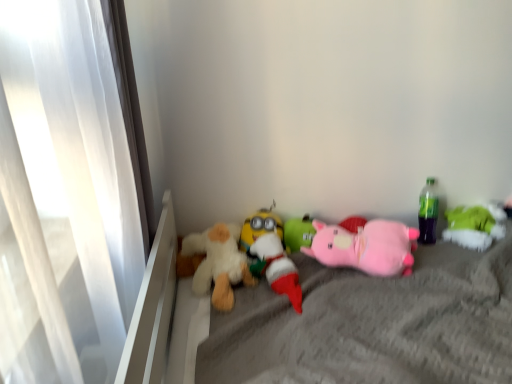
What do you see at coordinates (260, 228) in the screenshot? I see `yellow plush toy at center, which is the 2th toy from left to right` at bounding box center [260, 228].

Measure the distance between yellow plush toy at center, the fifth toy in the right-to-left sequence, and camera.

yellow plush toy at center, the fifth toy in the right-to-left sequence, is 1.58 meters from camera.

Measure the distance between point (484, 241) and camera.

Point (484, 241) and camera are 1.67 meters apart from each other.

Locate an element on the screen. Image resolution: width=512 pixels, height=384 pixels. white plush toy at center, which is counted as the fourth toy, starting from the right is located at coordinates (276, 268).

Measure the distance between point (x=263, y=242) and camera.

Point (x=263, y=242) is 1.54 meters from camera.

The width and height of the screenshot is (512, 384). What do you see at coordinates (359, 325) in the screenshot?
I see `soft gray fabric mattress at center` at bounding box center [359, 325].

Image resolution: width=512 pixels, height=384 pixels. Identify the location of yellow plush toy at center, the fifth toy in the right-to-left sequence. (260, 228).

Is pink plush pig at center, arranged as the 5th toy when viewed from the left, taller or shorter than yellow plush toy at center, the fifth toy in the right-to-left sequence?

In the image, pink plush pig at center, arranged as the 5th toy when viewed from the left, appears to be shorter than yellow plush toy at center, the fifth toy in the right-to-left sequence.

Does pink plush pig at center, arranged as the 5th toy when viewed from the left, have a larger size compared to yellow plush toy at center, which is the 2th toy from left to right?

Correct, pink plush pig at center, arranged as the 5th toy when viewed from the left, is larger in size than yellow plush toy at center, which is the 2th toy from left to right.

Do you think pink plush pig at center, arranged as the 5th toy when viewed from the left, is within yellow plush toy at center, the fifth toy in the right-to-left sequence, or outside of it?

pink plush pig at center, arranged as the 5th toy when viewed from the left, is not inside yellow plush toy at center, the fifth toy in the right-to-left sequence, it's outside.

Based on the photo, is pink plush pig at center, the second toy viewed from the right, far away from yellow plush toy at center, the fifth toy in the right-to-left sequence?

No, pink plush pig at center, the second toy viewed from the right, is not far from yellow plush toy at center, the fifth toy in the right-to-left sequence.

Is soft gray fabric mattress at center behind green fabric pillow at right, which ranks as the first toy in right-to-left order?

No, soft gray fabric mattress at center is closer to the viewer.

Is soft gray fabric mattress at center positioned with its back to green fabric pillow at right, which is the 6th toy from left to right?

No, soft gray fabric mattress at center is not facing away from green fabric pillow at right, which is the 6th toy from left to right.

Is soft gray fabric mattress at center taller or shorter than green fabric pillow at right, which ranks as the first toy in right-to-left order?

Considering their sizes, soft gray fabric mattress at center has more height than green fabric pillow at right, which ranks as the first toy in right-to-left order.

From the image's perspective, who appears lower, soft gray fabric mattress at center or green fabric pillow at right, which is the 6th toy from left to right?

soft gray fabric mattress at center, from the image's perspective.

Between soft gray fabric mattress at center and green plush toy at center, marked as the 4th toy in a left-to-right arrangement, which one has less height?

green plush toy at center, marked as the 4th toy in a left-to-right arrangement, is shorter.

Which is behind, point (332, 337) or point (305, 221)?

Positioned behind is point (305, 221).

Is soft gray fabric mattress at center completely or partially outside of green plush toy at center, marked as the 4th toy in a left-to-right arrangement?

Yes, soft gray fabric mattress at center is not within green plush toy at center, marked as the 4th toy in a left-to-right arrangement.

From a real-world perspective, which is physically below, soft gray fabric mattress at center or green plush toy at center, positioned as the third toy in right-to-left order?

soft gray fabric mattress at center is physically lower.

Which of these two, yellow plush toy at center, the fifth toy in the right-to-left sequence, or green fabric pillow at right, which ranks as the first toy in right-to-left order, is thinner?

yellow plush toy at center, the fifth toy in the right-to-left sequence.

Can we say yellow plush toy at center, which is the 2th toy from left to right, lies outside green fabric pillow at right, which is the 6th toy from left to right?

Yes, yellow plush toy at center, which is the 2th toy from left to right, is outside of green fabric pillow at right, which is the 6th toy from left to right.

Is yellow plush toy at center, which is the 2th toy from left to right, turned away from green fabric pillow at right, which is the 6th toy from left to right?

No.

Which is nearer, [264,208] or [473,213]?

Point [264,208] appears to be closer to the viewer than point [473,213].

Between soft gray fabric mattress at center and yellow plush toy at center, which is the 2th toy from left to right, which one has less height?

yellow plush toy at center, which is the 2th toy from left to right.

Considering their positions, is soft gray fabric mattress at center located in front of or behind yellow plush toy at center, the fifth toy in the right-to-left sequence?

In the image, soft gray fabric mattress at center appears in front of yellow plush toy at center, the fifth toy in the right-to-left sequence.

Is soft gray fabric mattress at center turned away from yellow plush toy at center, which is the 2th toy from left to right?

That's not correct — soft gray fabric mattress at center is not looking away from yellow plush toy at center, which is the 2th toy from left to right.

Is pink plush pig at center, arranged as the 5th toy when viewed from the left, facing away from white plush toy at center, which is counted as the fourth toy, starting from the right?

No, pink plush pig at center, arranged as the 5th toy when viewed from the left, is not facing the opposite direction of white plush toy at center, which is counted as the fourth toy, starting from the right.

From the image's perspective, between pink plush pig at center, the second toy viewed from the right, and white plush toy at center, the third toy when ordered from left to right, which one is located above?

pink plush pig at center, the second toy viewed from the right.

From a real-world perspective, relative to white plush toy at center, which is counted as the fourth toy, starting from the right, is pink plush pig at center, the second toy viewed from the right, vertically above or below?

From a real-world perspective, pink plush pig at center, the second toy viewed from the right, is physically below white plush toy at center, which is counted as the fourth toy, starting from the right.

Considering the sizes of objects pink plush pig at center, arranged as the 5th toy when viewed from the left, and white plush toy at center, which is counted as the fourth toy, starting from the right, in the image provided, who is taller, pink plush pig at center, arranged as the 5th toy when viewed from the left, or white plush toy at center, which is counted as the fourth toy, starting from the right,?

white plush toy at center, which is counted as the fourth toy, starting from the right.

Is there a large distance between fluffy white teddy bear at center, positioned as the 6th toy in right-to-left order, and green fabric pillow at right, which ranks as the first toy in right-to-left order?

No, fluffy white teddy bear at center, positioned as the 6th toy in right-to-left order, is in close proximity to green fabric pillow at right, which ranks as the first toy in right-to-left order.

Which is farther from the camera, (233, 273) or (465, 214)?

The point (465, 214) is farther.

Does fluffy white teddy bear at center, positioned as the 6th toy in right-to-left order, have a larger size compared to green fabric pillow at right, which ranks as the first toy in right-to-left order?

Correct, fluffy white teddy bear at center, positioned as the 6th toy in right-to-left order, is larger in size than green fabric pillow at right, which ranks as the first toy in right-to-left order.

How different are the orientations of fluffy white teddy bear at center, acting as the 1th toy starting from the left, and green fabric pillow at right, which is the 6th toy from left to right, in degrees?

The angular difference between fluffy white teddy bear at center, acting as the 1th toy starting from the left, and green fabric pillow at right, which is the 6th toy from left to right, is 1.83e-05 degrees.

Which toy is the 3rd one when counting from the right side of the yellow plush toy at center, the fifth toy in the right-to-left sequence? Please provide its 2D coordinates.

[(366, 247)]

This screenshot has height=384, width=512. I want to click on toy that is the 4th one when counting backward from the soft gray fabric mattress at center, so click(x=474, y=226).

Which object lies nearer to the anchor point pink plush pig at center, the second toy viewed from the right, soft gray fabric mattress at center or fluffy white teddy bear at center, positioned as the 6th toy in right-to-left order?

Among the two, soft gray fabric mattress at center is located nearer to pink plush pig at center, the second toy viewed from the right.

Based on their spatial positions, is fluffy white teddy bear at center, positioned as the 6th toy in right-to-left order, or green plush toy at center, marked as the 4th toy in a left-to-right arrangement, further from soft gray fabric mattress at center?

Based on the image, green plush toy at center, marked as the 4th toy in a left-to-right arrangement, appears to be further to soft gray fabric mattress at center.

From the image, which object appears to be farther from green fabric pillow at right, which ranks as the first toy in right-to-left order, pink plush pig at center, the second toy viewed from the right, or fluffy white teddy bear at center, positioned as the 6th toy in right-to-left order?

Among the two, fluffy white teddy bear at center, positioned as the 6th toy in right-to-left order, is located further to green fabric pillow at right, which ranks as the first toy in right-to-left order.

Based on their spatial positions, is fluffy white teddy bear at center, acting as the 1th toy starting from the left, or white plush toy at center, the third toy when ordered from left to right, further from soft gray fabric mattress at center?

Based on the image, fluffy white teddy bear at center, acting as the 1th toy starting from the left, appears to be further to soft gray fabric mattress at center.

Based on their spatial positions, is pink plush pig at center, the second toy viewed from the right, or yellow plush toy at center, which is the 2th toy from left to right, closer to fluffy white teddy bear at center, positioned as the 6th toy in right-to-left order?

Among the two, yellow plush toy at center, which is the 2th toy from left to right, is located nearer to fluffy white teddy bear at center, positioned as the 6th toy in right-to-left order.

Which object lies nearer to the anchor point fluffy white teddy bear at center, acting as the 1th toy starting from the left, green plush toy at center, positioned as the third toy in right-to-left order, or pink plush pig at center, the second toy viewed from the right?

green plush toy at center, positioned as the third toy in right-to-left order.

Which object lies further to the anchor point fluffy white teddy bear at center, acting as the 1th toy starting from the left, yellow plush toy at center, the fifth toy in the right-to-left sequence, or soft gray fabric mattress at center?

soft gray fabric mattress at center is positioned further to the anchor fluffy white teddy bear at center, acting as the 1th toy starting from the left.

Based on their spatial positions, is fluffy white teddy bear at center, positioned as the 6th toy in right-to-left order, or green plush toy at center, marked as the 4th toy in a left-to-right arrangement, further from white plush toy at center, which is counted as the fourth toy, starting from the right?

The object further to white plush toy at center, which is counted as the fourth toy, starting from the right, is green plush toy at center, marked as the 4th toy in a left-to-right arrangement.

In order to click on toy between soft gray fabric mattress at center and fluffy white teddy bear at center, positioned as the 6th toy in right-to-left order, along the z-axis in this screenshot , I will do `click(276, 268)`.

Where is `toy between green plush toy at center, marked as the 4th toy in a left-to-right arrangement, and green fabric pillow at right, which ranks as the first toy in right-to-left order, from left to right`? The height and width of the screenshot is (384, 512). toy between green plush toy at center, marked as the 4th toy in a left-to-right arrangement, and green fabric pillow at right, which ranks as the first toy in right-to-left order, from left to right is located at coordinates (366, 247).

Find the location of `mattress between fluffy white teddy bear at center, acting as the 1th toy starting from the left, and green fabric pillow at right, which is the 6th toy from left to right, in the horizontal direction`. mattress between fluffy white teddy bear at center, acting as the 1th toy starting from the left, and green fabric pillow at right, which is the 6th toy from left to right, in the horizontal direction is located at coordinates (359, 325).